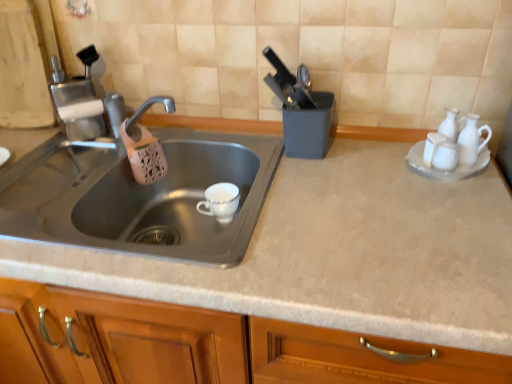
Image resolution: width=512 pixels, height=384 pixels. What are the coordinates of `vacant area that lies in front of white ceramic saucer at right` in the screenshot? It's located at (456, 214).